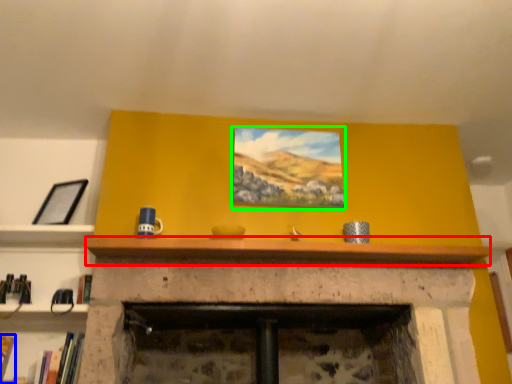
Question: Which object is positioned farthest from mantle (highlighted by a red box)? Select from book (highlighted by a blue box) and picture frame (highlighted by a green box).

Choices:
 (A) book
 (B) picture frame

Answer: (A)